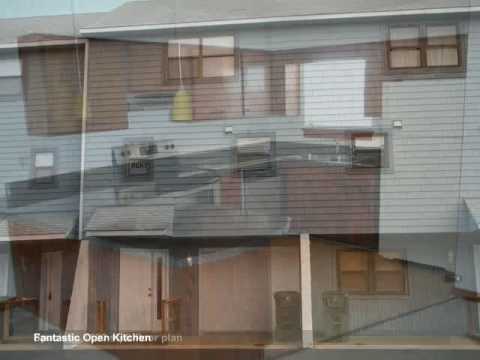
Identify the location of garbage cans in glare. (284, 326), (289, 306), (336, 306), (334, 329).